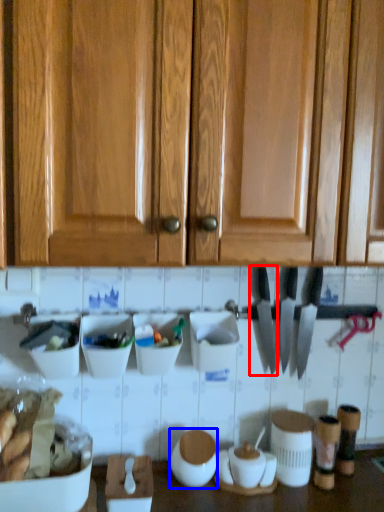
Question: Which point is further to the camera, knife (highlighted by a red box) or appliance (highlighted by a blue box)?

Choices:
 (A) knife
 (B) appliance

Answer: (A)